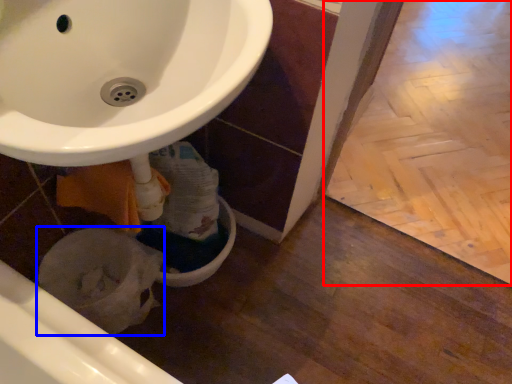
Question: Which object appears closest to the camera in this image, tile (highlighted by a red box) or bidet (highlighted by a blue box)?

Choices:
 (A) tile
 (B) bidet

Answer: (B)